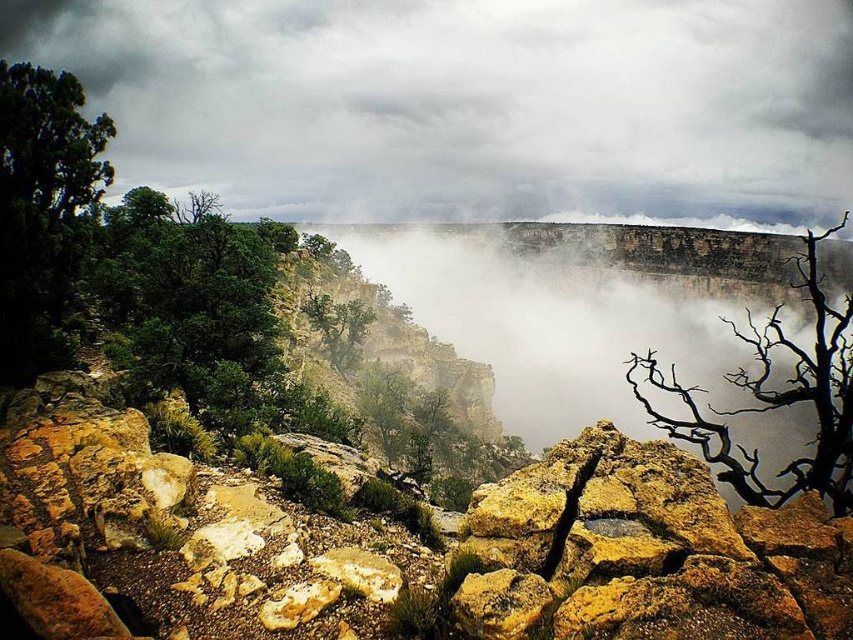
Is foggy mist at center bigger than yellowish rock at center?

Yes, foggy mist at center is bigger than yellowish rock at center.

Is point (688, 368) positioned after point (486, 588)?

Yes, point (688, 368) is farther from viewer.

Locate an element on the screen. This screenshot has height=640, width=853. foggy mist at center is located at coordinates (575, 310).

Describe the element at coordinates (575, 310) in the screenshot. The image size is (853, 640). I see `foggy mist at center` at that location.

Does foggy mist at center lie in front of black deadwood at right?

No, it is behind black deadwood at right.

Does point (579, 244) come behind point (781, 337)?

That is True.

Where is `foggy mist at center`? foggy mist at center is located at coordinates (575, 310).

Does cloudy sky at upper center have a lesser width compared to yellowish rock at center?

No, cloudy sky at upper center is not thinner than yellowish rock at center.

Does point (741, 164) come closer to viewer compared to point (520, 582)?

No.

I want to click on cloudy sky at upper center, so click(468, 104).